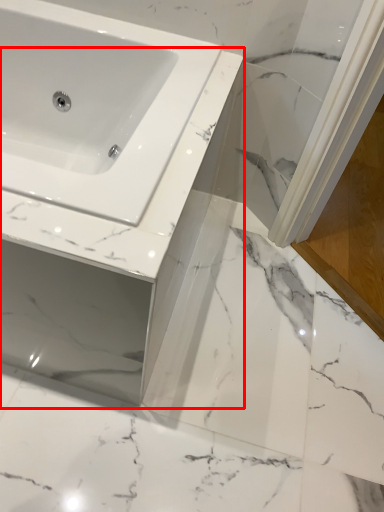
Question: In this image, where is counter top (annotated by the red box) located relative to screen door?

Choices:
 (A) left
 (B) right

Answer: (A)